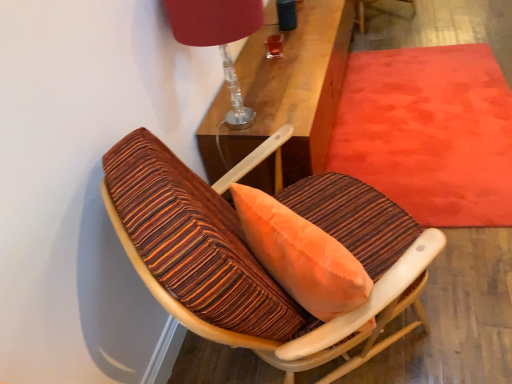
Question: Does wooden textured chair at center appear on the right side of matte red lampshade at upper center?

Choices:
 (A) yes
 (B) no

Answer: (A)

Question: Is wooden textured chair at center facing away from matte red lampshade at upper center?

Choices:
 (A) yes
 (B) no

Answer: (B)

Question: Considering the relative sizes of wooden textured chair at center and matte red lampshade at upper center in the image provided, is wooden textured chair at center taller than matte red lampshade at upper center?

Choices:
 (A) no
 (B) yes

Answer: (B)

Question: Is wooden textured chair at center next to matte red lampshade at upper center and touching it?

Choices:
 (A) no
 (B) yes

Answer: (A)

Question: Does wooden textured chair at center have a smaller size compared to matte red lampshade at upper center?

Choices:
 (A) no
 (B) yes

Answer: (A)

Question: Considering the relative sizes of wooden textured chair at center and matte red lampshade at upper center in the image provided, is wooden textured chair at center bigger than matte red lampshade at upper center?

Choices:
 (A) no
 (B) yes

Answer: (B)

Question: From a real-world perspective, does matte red lampshade at upper center stand above wooden textured chair at center?

Choices:
 (A) no
 (B) yes

Answer: (B)

Question: Can we say matte red lampshade at upper center lies outside wooden textured chair at center?

Choices:
 (A) no
 (B) yes

Answer: (B)

Question: Considering the relative sizes of matte red lampshade at upper center and wooden textured chair at center in the image provided, is matte red lampshade at upper center thinner than wooden textured chair at center?

Choices:
 (A) no
 (B) yes

Answer: (B)

Question: Is matte red lampshade at upper center further to the viewer compared to wooden textured chair at center?

Choices:
 (A) yes
 (B) no

Answer: (A)

Question: From the image's perspective, is matte red lampshade at upper center over wooden textured chair at center?

Choices:
 (A) yes
 (B) no

Answer: (A)

Question: Does matte red lampshade at upper center turn towards wooden textured chair at center?

Choices:
 (A) yes
 (B) no

Answer: (B)

Question: Does velvet red mat at upper right have a lesser width compared to matte red lampshade at upper center?

Choices:
 (A) no
 (B) yes

Answer: (A)